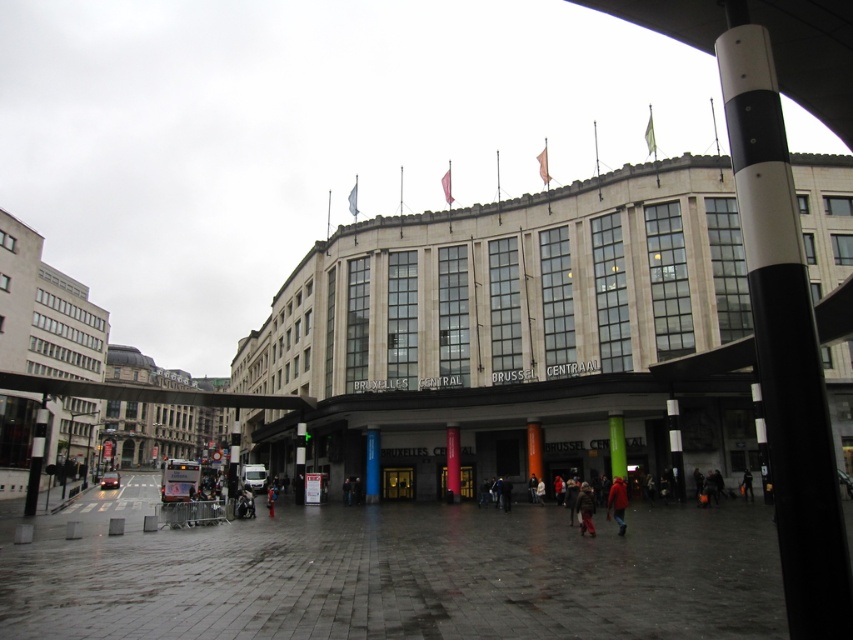
Which is more to the right, beige stone building at center or red wool coat at lower center?

From the viewer's perspective, red wool coat at lower center appears more on the right side.

Can you confirm if beige stone building at center is thinner than red wool coat at lower center?

No.

Is point (703, 314) farther from viewer compared to point (610, 493)?

Yes, it is.

Identify the location of beige stone building at center. Image resolution: width=853 pixels, height=640 pixels. (506, 330).

Who is shorter, red wool coat at lower center or dark brown leather jacket at center?

dark brown leather jacket at center

Is red wool coat at lower center above dark brown leather jacket at center?

No.

Is point (624, 492) in front of point (589, 496)?

No, it is not.

What are the coordinates of `red wool coat at lower center` in the screenshot? It's located at (618, 502).

Can you confirm if black and white striped pole at upper right is bigger than dark brown leather jacket at center?

Indeed, black and white striped pole at upper right has a larger size compared to dark brown leather jacket at center.

Looking at this image, does black and white striped pole at upper right lie behind dark brown leather jacket at center?

No, it is in front of dark brown leather jacket at center.

Is point (830, 541) behind point (583, 531)?

That is False.

I want to click on black and white striped pole at upper right, so click(x=784, y=339).